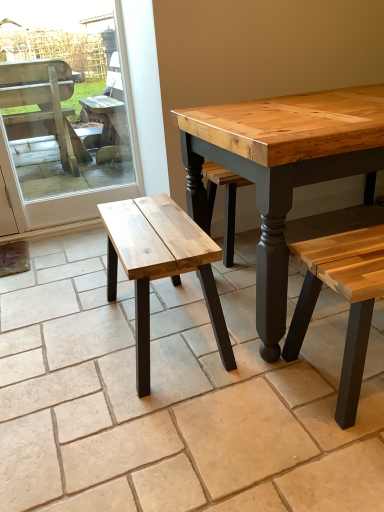
The width and height of the screenshot is (384, 512). In order to click on free region under natural wood bench at center (from a real-world perspective) in this screenshot , I will do `click(168, 328)`.